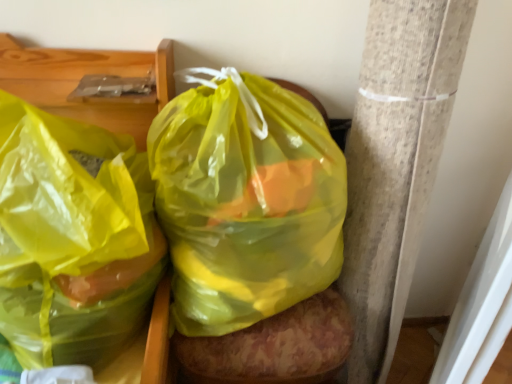
Question: Can you confirm if translucent yellow plastic bag at left, which is the second plastic bag from right to left, is taller than translucent yellow plastic bag at center, the first plastic bag in the right-to-left sequence?

Choices:
 (A) no
 (B) yes

Answer: (A)

Question: Is translucent yellow plastic bag at left, which is the second plastic bag from right to left, further to the viewer compared to translucent yellow plastic bag at center, the first plastic bag in the right-to-left sequence?

Choices:
 (A) yes
 (B) no

Answer: (B)

Question: Is translucent yellow plastic bag at left, which is the 1th plastic bag in left-to-right order, bigger than translucent yellow plastic bag at center, arranged as the 2th plastic bag when viewed from the left?

Choices:
 (A) no
 (B) yes

Answer: (B)

Question: Does translucent yellow plastic bag at left, which is the 1th plastic bag in left-to-right order, lie in front of translucent yellow plastic bag at center, the first plastic bag in the right-to-left sequence?

Choices:
 (A) yes
 (B) no

Answer: (A)

Question: Is translucent yellow plastic bag at left, which is the 1th plastic bag in left-to-right order, wider than translucent yellow plastic bag at center, the first plastic bag in the right-to-left sequence?

Choices:
 (A) yes
 (B) no

Answer: (A)

Question: Is translucent yellow plastic bag at left, which is the second plastic bag from right to left, thinner than translucent yellow plastic bag at center, arranged as the 2th plastic bag when viewed from the left?

Choices:
 (A) yes
 (B) no

Answer: (B)

Question: From the image's perspective, does translucent yellow plastic bag at center, the first plastic bag in the right-to-left sequence, appear lower than translucent yellow plastic bag at left, which is the 1th plastic bag in left-to-right order?

Choices:
 (A) no
 (B) yes

Answer: (A)

Question: Is translucent yellow plastic bag at center, arranged as the 2th plastic bag when viewed from the left, far away from translucent yellow plastic bag at left, which is the second plastic bag from right to left?

Choices:
 (A) no
 (B) yes

Answer: (A)

Question: Is translucent yellow plastic bag at center, the first plastic bag in the right-to-left sequence, further to camera compared to translucent yellow plastic bag at left, which is the 1th plastic bag in left-to-right order?

Choices:
 (A) no
 (B) yes

Answer: (B)

Question: Does translucent yellow plastic bag at center, arranged as the 2th plastic bag when viewed from the left, have a lesser width compared to translucent yellow plastic bag at left, which is the second plastic bag from right to left?

Choices:
 (A) yes
 (B) no

Answer: (A)

Question: Is the depth of translucent yellow plastic bag at center, arranged as the 2th plastic bag when viewed from the left, less than that of translucent yellow plastic bag at left, which is the 1th plastic bag in left-to-right order?

Choices:
 (A) no
 (B) yes

Answer: (A)

Question: From the image's perspective, is translucent yellow plastic bag at center, arranged as the 2th plastic bag when viewed from the left, above translucent yellow plastic bag at left, which is the 1th plastic bag in left-to-right order?

Choices:
 (A) yes
 (B) no

Answer: (A)

Question: In terms of height, does translucent yellow plastic bag at center, the first plastic bag in the right-to-left sequence, look taller or shorter compared to translucent yellow plastic bag at left, which is the 1th plastic bag in left-to-right order?

Choices:
 (A) short
 (B) tall

Answer: (B)